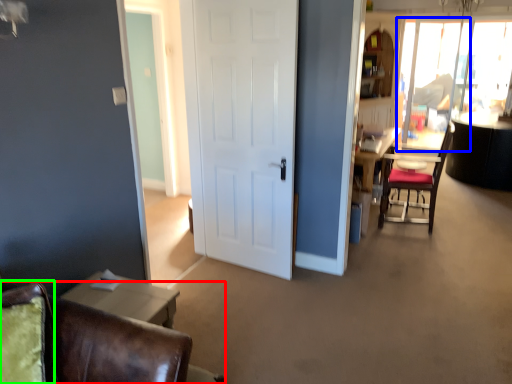
Question: Estimate the real-world distances between objects in this image. Which object is closer to chair (highlighted by a red box), window screen (highlighted by a blue box) or swivel chair (highlighted by a green box)?

Choices:
 (A) window screen
 (B) swivel chair

Answer: (B)